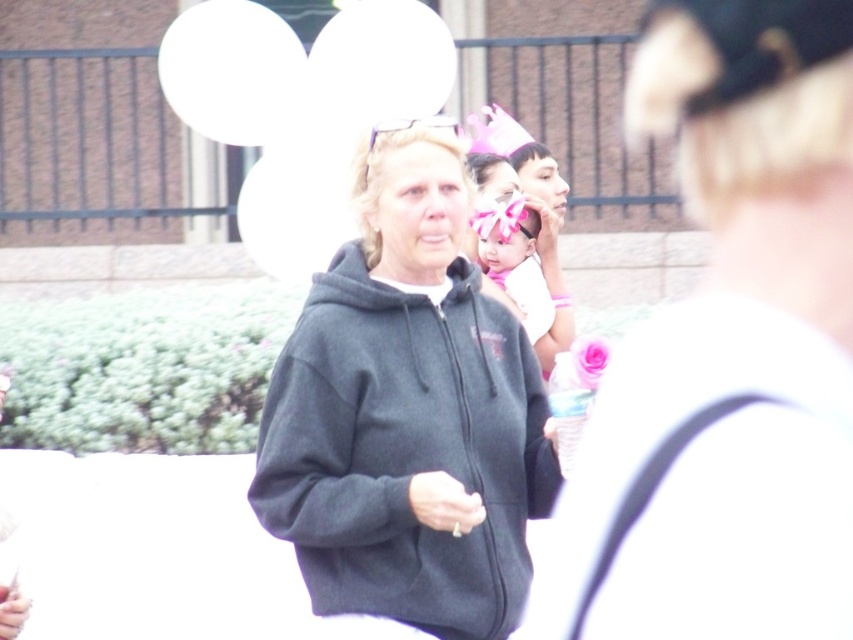
You are at a party and need to decide which item is closer to the camera. The dark gray hoodie at center and the pink satin headband at center are both in your view. Based on their positions, which one is closer?

The dark gray hoodie at center is shorter than the pink satin headband at center, meaning the dark gray hoodie at center is closer to the camera.

Based on the coordinates provided, which object is located at point (407,413) in the scene?

The point (407,413) marks the location of the dark gray hoodie at center.